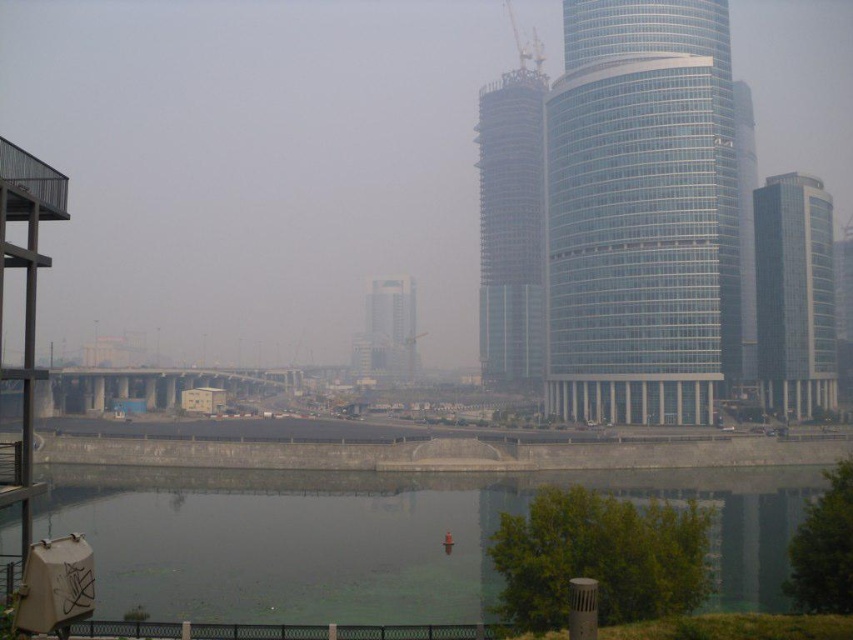
You are a delivery drone with a wingspan of 10 feet. You need to fly between the transparent glass tower at center and the clear glass skyscraper at center. Can you safely navigate the space between them without hitting either structure?

The transparent glass tower at center and clear glass skyscraper at center are 115.81 feet apart from each other. Since your wingspan is only 10 feet, there is more than enough space to safely navigate between them without any collision risks.

You are an architect reviewing this urban landscape. You notice the transparent glass skyscraper at right and the white glass building at center. Based on their positions, which one appears to be taller when viewed from the water?

The transparent glass skyscraper at right is located above the white glass building at center, so it appears taller when viewed from the water.

You are standing at the point labeled point [641,211] in the urban landscape. What structure are you facing directly?

The point labeled point [641,211] corresponds to the transparent glass tower at center, so you are facing the transparent glass tower at center directly.